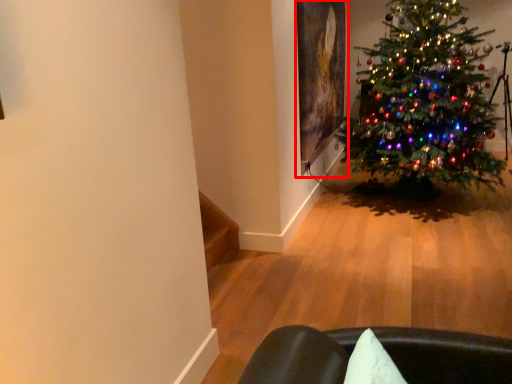
Question: Where is picture frame (annotated by the red box) located in relation to christmas tree in the image?

Choices:
 (A) left
 (B) right

Answer: (A)